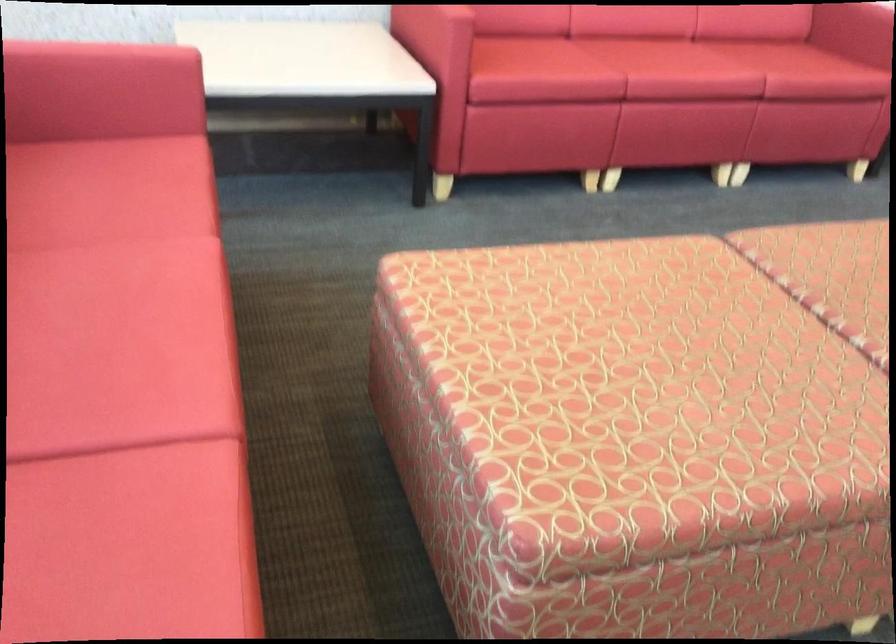
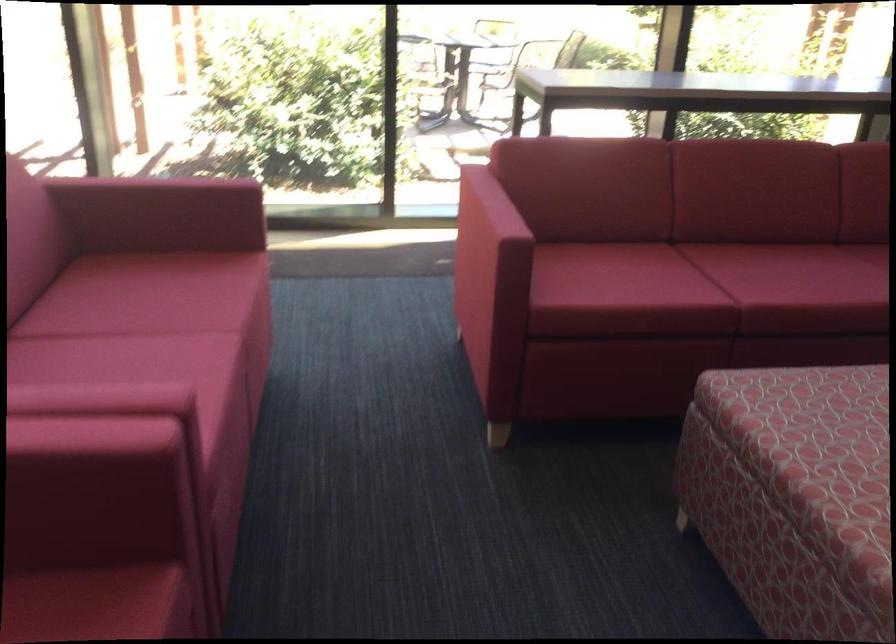
Where in the second image is the point corresponding to the point at 722,464 from the first image?

(815, 460)